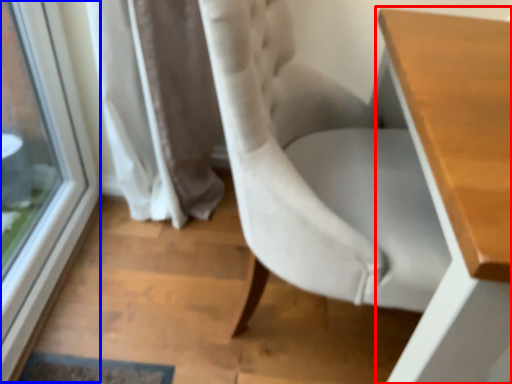
Question: Among these objects, which one is nearest to the camera, table (highlighted by a red box) or window (highlighted by a blue box)?

Choices:
 (A) table
 (B) window

Answer: (A)